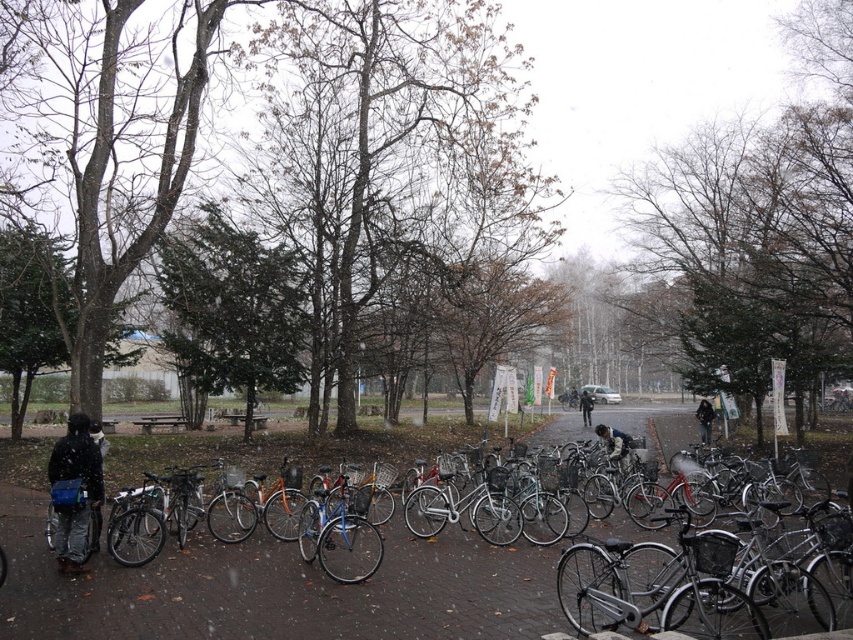
Does smooth concrete pavement at center appear on the left side of dark gray jacket at center-right?

Indeed, smooth concrete pavement at center is positioned on the left side of dark gray jacket at center-right.

Does point (485, 620) lie behind point (701, 429)?

No.

Which is in front, point (543, 436) or point (706, 410)?

Positioned in front is point (706, 410).

You are a GUI agent. You are given a task and a screenshot of the screen. Output one action in this format:
    pyautogui.click(x=<x>, y=<y>)
    Task: Click on the smooth concrete pavement at center
    
    Given the screenshot: What is the action you would take?
    [x=276, y=589]

Does point (321, 522) come closer to viewer compared to point (619, 467)?

Yes, it is.

Which is in front, point (318, 536) or point (619, 440)?

Point (318, 536)

Find the location of a particular element. This screenshot has width=853, height=640. shiny blue bicycle at center is located at coordinates (340, 532).

Who is positioned more to the left, shiny black bicycle at lower right or shiny blue bicycle at center?

shiny blue bicycle at center is more to the left.

Between point (715, 628) and point (341, 532), which one is positioned behind?

The point (341, 532) is behind.

The image size is (853, 640). What do you see at coordinates (657, 586) in the screenshot?
I see `shiny black bicycle at lower right` at bounding box center [657, 586].

This screenshot has width=853, height=640. Find the location of `shiny black bicycle at lower right`. shiny black bicycle at lower right is located at coordinates (657, 586).